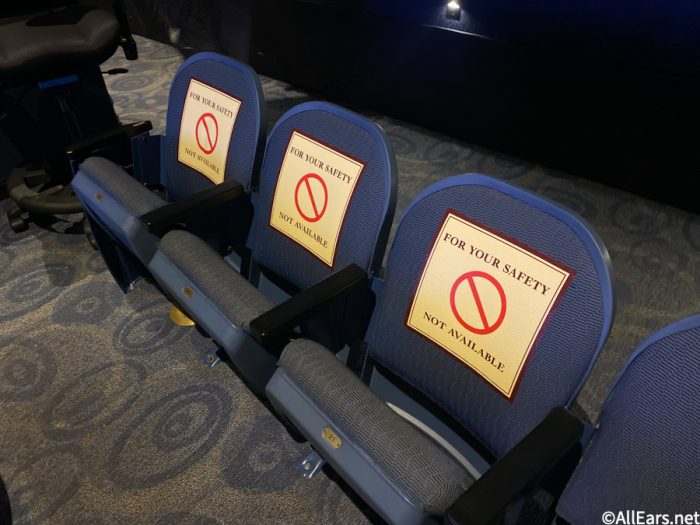
This screenshot has width=700, height=525. Identify the location of light. (452, 0).